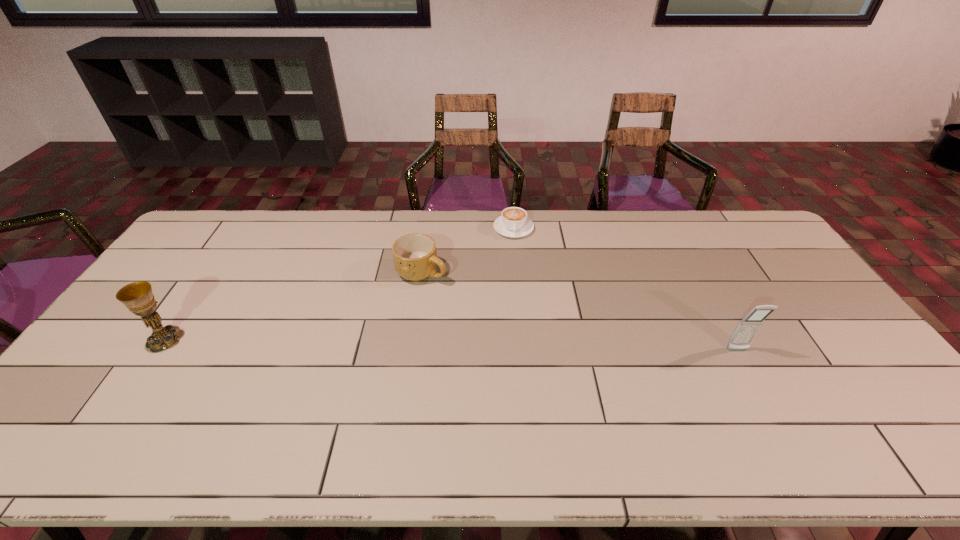
At what (x,y) coordinates should I click in order to perform the action: click on the leftmost object. Please return your answer as a coordinate pair (x, y). This screenshot has height=540, width=960. Looking at the image, I should click on (137, 296).

I want to click on the rightmost object, so click(747, 328).

Find the location of `the second farthest object`. the second farthest object is located at coordinates (415, 257).

This screenshot has height=540, width=960. In order to click on the second shortest object in this screenshot , I will do `click(415, 257)`.

Image resolution: width=960 pixels, height=540 pixels. In order to click on the third object from left to right in this screenshot , I will do `click(513, 222)`.

This screenshot has height=540, width=960. In order to click on the farthest object in this screenshot , I will do `click(513, 222)`.

The height and width of the screenshot is (540, 960). I want to click on vacant space located 0.290m on the right of the leftmost object, so click(x=286, y=339).

The height and width of the screenshot is (540, 960). Find the location of `vacant space situated on the front-facing side of the cellular telephone`. vacant space situated on the front-facing side of the cellular telephone is located at coordinates (762, 395).

The image size is (960, 540). In order to click on free space located on the side with the handle of the second object from left to right in this screenshot , I will do `click(537, 353)`.

Where is `free space located on the side with the handle of the second object from left to right`? Image resolution: width=960 pixels, height=540 pixels. free space located on the side with the handle of the second object from left to right is located at coordinates (507, 331).